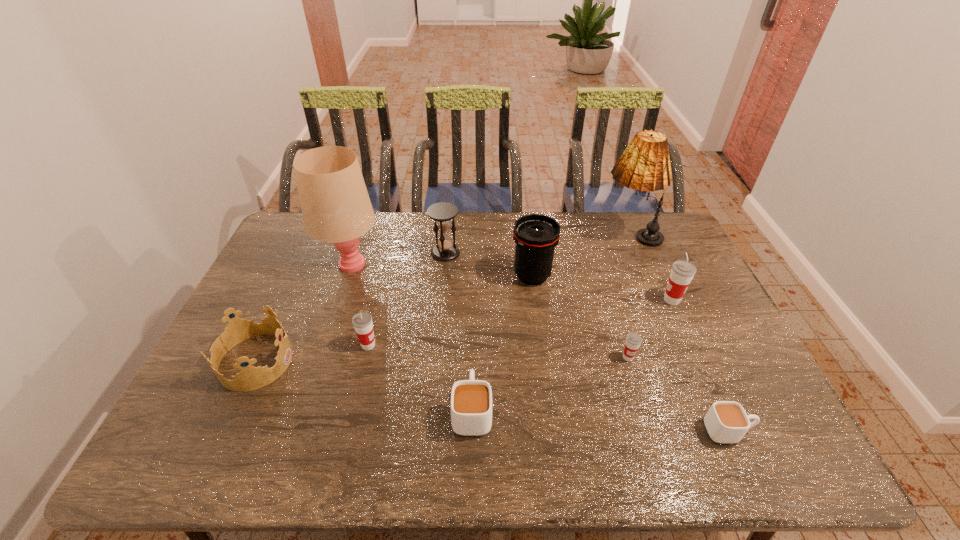
You are a GUI agent. You are given a task and a screenshot of the screen. Output one action in this format:
    pyautogui.click(x=<x>, y=<y>)
    Task: Click on the vacant space at the right edge of the desktop
    Image resolution: width=960 pixels, height=540 pixels.
    Given the screenshot: What is the action you would take?
    pyautogui.click(x=655, y=261)

In the image, there is a desktop. At what (x,y) coordinates should I click in order to perform the action: click on vacant region at the far left corner. Please return your answer as a coordinate pair (x, y). The image size is (960, 540). Looking at the image, I should click on (284, 242).

Where is `blank space at the far right corner`? This screenshot has width=960, height=540. blank space at the far right corner is located at coordinates (684, 245).

Where is `empty space between the telephoto lens and the hourglass`? Image resolution: width=960 pixels, height=540 pixels. empty space between the telephoto lens and the hourglass is located at coordinates (489, 264).

Identify the location of vacant space that's between the second red cup from right to left and the pink lampshade. The height and width of the screenshot is (540, 960). (490, 312).

Locate an element on the screen. The image size is (960, 540). empty space that is in between the fourth object from right to left and the second biggest red cup is located at coordinates (498, 352).

Identify the location of empty space between the pink lampshade and the telephoto lens. The image size is (960, 540). (442, 271).

Image resolution: width=960 pixels, height=540 pixels. In order to click on blank region between the farthest red cup and the left lampshade in this screenshot , I will do `click(512, 282)`.

This screenshot has height=540, width=960. I want to click on free area in between the bigger white cup and the right lampshade, so click(551, 323).

Where is `free space between the smallest red cup and the tiara`? Image resolution: width=960 pixels, height=540 pixels. free space between the smallest red cup and the tiara is located at coordinates (442, 359).